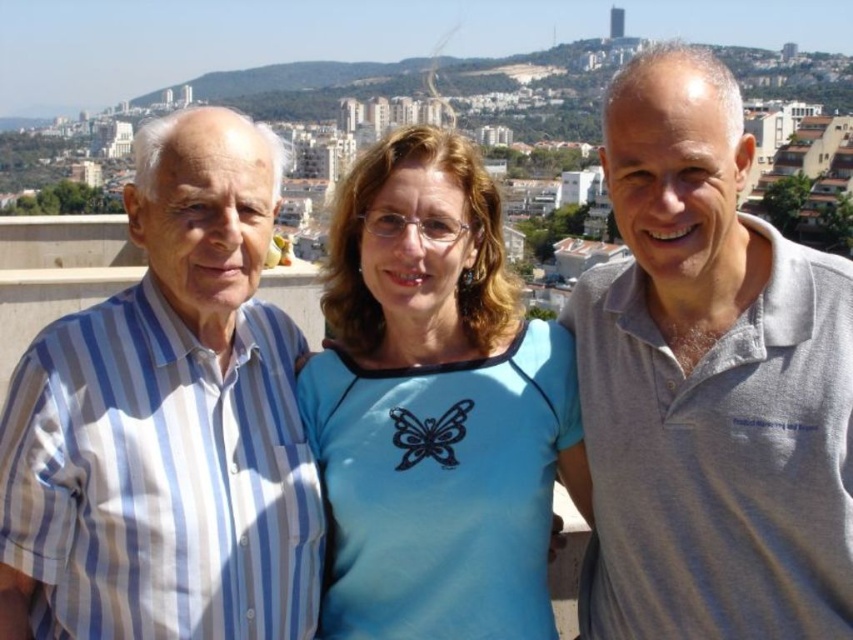
Question: Which point is farther to the camera?

Choices:
 (A) gray cotton polo shirt at right
 (B) blue fabric shirt at center

Answer: (B)

Question: Is gray cotton polo shirt at right in front of blue striped shirt at left?

Choices:
 (A) yes
 (B) no

Answer: (A)

Question: Considering the real-world distances, which object is farthest from the gray cotton polo shirt at right?

Choices:
 (A) blue fabric shirt at center
 (B) blue striped shirt at left

Answer: (B)

Question: Estimate the real-world distances between objects in this image. Which object is farther from the gray cotton polo shirt at right?

Choices:
 (A) blue fabric shirt at center
 (B) blue striped shirt at left

Answer: (B)

Question: Is blue striped shirt at left smaller than blue fabric shirt at center?

Choices:
 (A) yes
 (B) no

Answer: (B)

Question: In this image, where is gray cotton polo shirt at right located relative to blue striped shirt at left?

Choices:
 (A) above
 (B) below

Answer: (A)